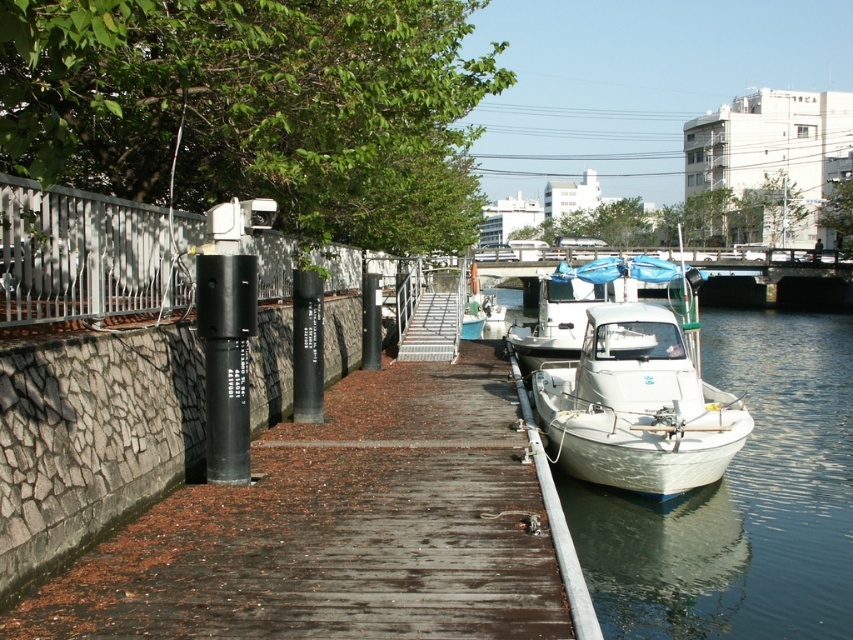
Is white glossy boat at lower right thinner than white matte boat at lower right?

In fact, white glossy boat at lower right might be wider than white matte boat at lower right.

Between white glossy boat at lower right and white matte boat at lower right, which one appears on the right side from the viewer's perspective?

white glossy boat at lower right is more to the right.

Who is more distant from viewer, (816, 548) or (605, 440)?

The point (605, 440) is behind.

This screenshot has width=853, height=640. In order to click on white glossy boat at lower right in this screenshot , I will do `click(740, 500)`.

Is point (422, 616) more distant than point (592, 278)?

No.

Is brown wooden dock at center further to the viewer compared to white matte boat at center?

No, it is in front of white matte boat at center.

Does point (268, 467) come behind point (563, 296)?

No, (268, 467) is closer to viewer.

Where is `brown wooden dock at center`? brown wooden dock at center is located at coordinates (349, 529).

Which is above, brown wooden dock at center or white glossy boat at lower right?

brown wooden dock at center is above.

Where is `brown wooden dock at center`? The height and width of the screenshot is (640, 853). brown wooden dock at center is located at coordinates (349, 529).